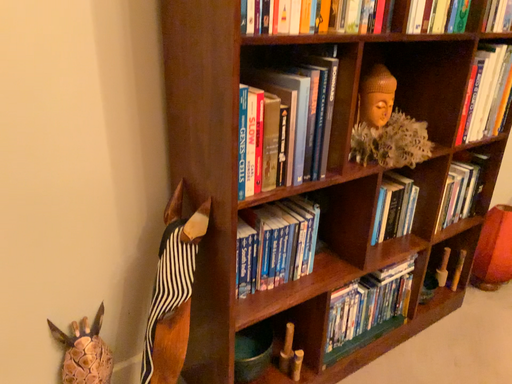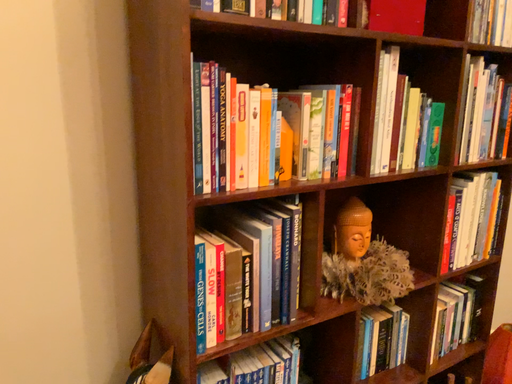
Question: Which way did the camera rotate in the video?

Choices:
 (A) rotated upward
 (B) rotated downward

Answer: (A)